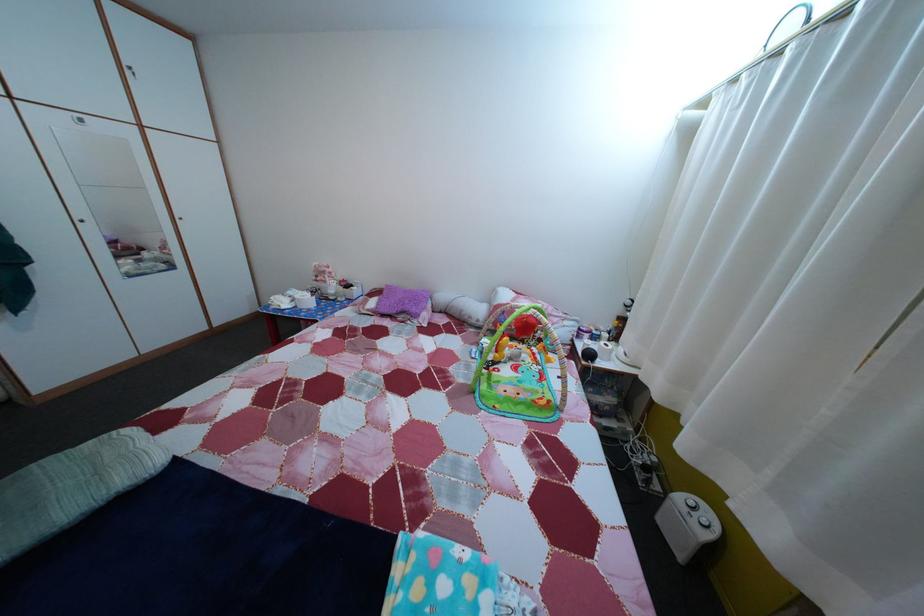
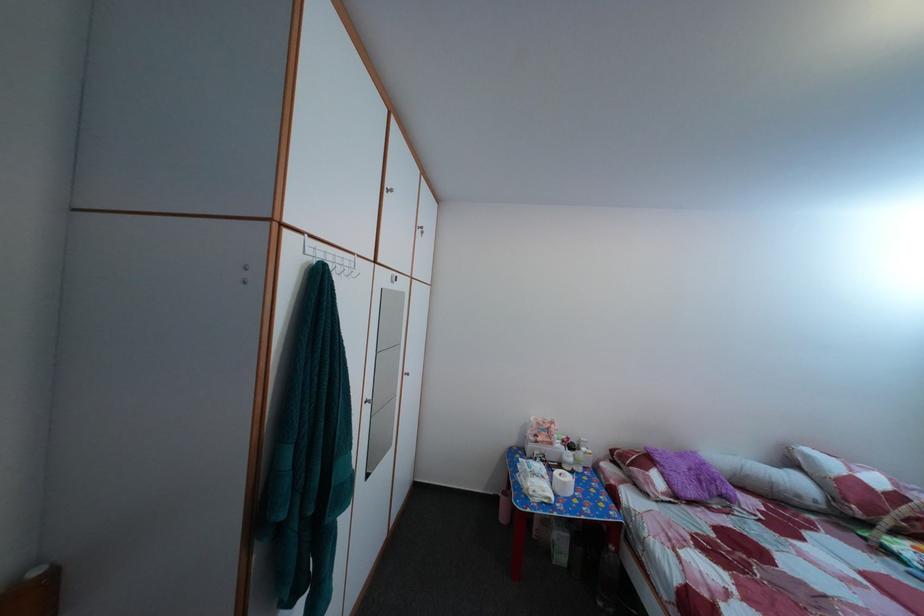
The point at (354, 288) is marked in the first image. Where is the corresponding point in the second image?

(578, 447)